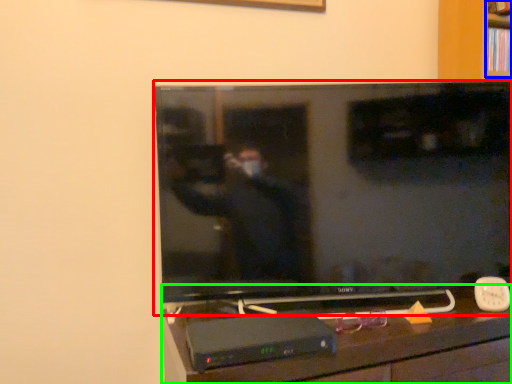
Question: Which is nearer to the television (highlighted by a red box)? shelf (highlighted by a blue box) or furniture (highlighted by a green box).

Choices:
 (A) shelf
 (B) furniture

Answer: (B)